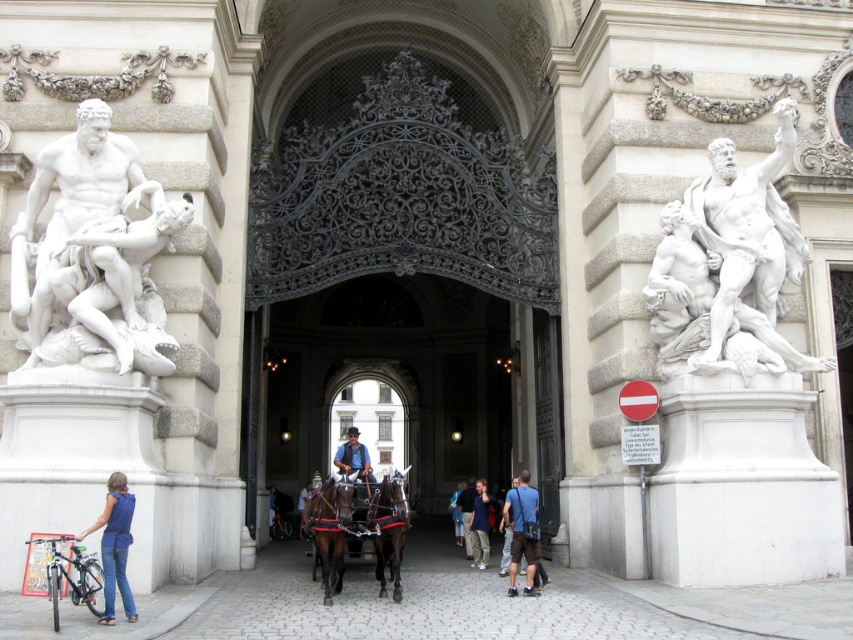
You are standing at the entrance of the grand building and notice a brown glossy horse at center and a blue fabric bag at center. From your perspective, which object is positioned to the left?

The brown glossy horse at center is to the left of the blue fabric bag at center.

From the picture: You are a tour guide standing at the entrance of the grand building. You notice a shiny dark brown horse at center and blue denim jeans at center. A visitor asks if they can ride the horse to the nearby park, which is 50 feet away. Can they make it without the horse getting too tired? Please explain.

The shiny dark brown horse at center is 48.23 feet from blue denim jeans at center. Since the park is 50 feet away, the distance is slightly longer than the current separation between the horse and the jeans. However, horses can typically handle short distances like this without excessive fatigue. The visitor could likely ride the horse to the park, but should be mindful of the horse not being overexerted.